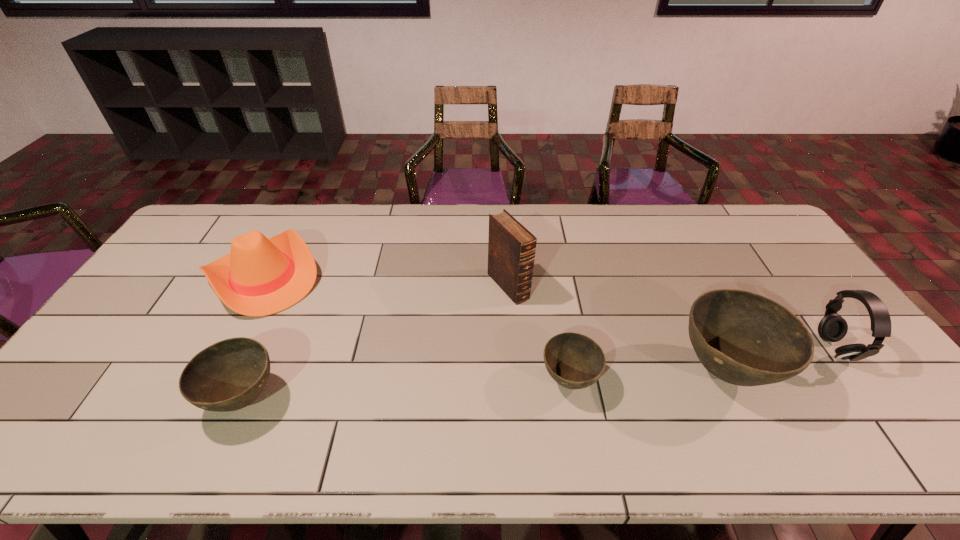
At what (x,y) coordinates should I click in order to perform the action: click on the leftmost bowl. Please return your answer as a coordinate pair (x, y). Looking at the image, I should click on (228, 375).

The width and height of the screenshot is (960, 540). In order to click on the second tallest bowl in this screenshot , I will do coord(228,375).

Where is `the shortest object`? The width and height of the screenshot is (960, 540). the shortest object is located at coordinates (575, 361).

This screenshot has width=960, height=540. Identify the location of the second bowl from right to left. (575, 361).

The width and height of the screenshot is (960, 540). What are the coordinates of `the rightmost bowl` in the screenshot? It's located at (743, 338).

Locate an element on the screen. This screenshot has height=540, width=960. the fifth object from left to right is located at coordinates (743, 338).

At what (x,y) coordinates should I click in order to perform the action: click on cowboy hat. Please return your answer as a coordinate pair (x, y). The width and height of the screenshot is (960, 540). Looking at the image, I should click on (262, 276).

Image resolution: width=960 pixels, height=540 pixels. I want to click on Bible, so click(511, 247).

This screenshot has height=540, width=960. What are the coordinates of `the tallest object` in the screenshot? It's located at (511, 247).

Find the location of a particular element. The image size is (960, 540). the rightmost object is located at coordinates (832, 327).